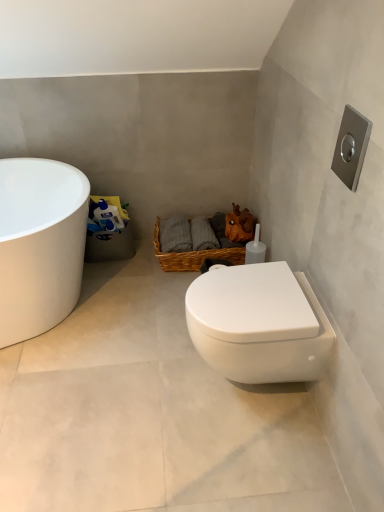
Question: Does white glossy toilet at lower right have a smaller size compared to white glossy bathtub at left?

Choices:
 (A) yes
 (B) no

Answer: (A)

Question: Does white glossy toilet at lower right have a larger size compared to white glossy bathtub at left?

Choices:
 (A) yes
 (B) no

Answer: (B)

Question: Does white glossy toilet at lower right have a greater width compared to white glossy bathtub at left?

Choices:
 (A) no
 (B) yes

Answer: (B)

Question: From a real-world perspective, is white glossy toilet at lower right physically below white glossy bathtub at left?

Choices:
 (A) yes
 (B) no

Answer: (A)

Question: From the image's perspective, is white glossy toilet at lower right on top of white glossy bathtub at left?

Choices:
 (A) yes
 (B) no

Answer: (B)

Question: From a real-world perspective, is white glossy bathtub at left physically located above or below white glossy toilet at lower right?

Choices:
 (A) below
 (B) above

Answer: (B)

Question: Is white glossy bathtub at left taller or shorter than white glossy toilet at lower right?

Choices:
 (A) tall
 (B) short

Answer: (A)

Question: Is white glossy bathtub at left inside or outside of white glossy toilet at lower right?

Choices:
 (A) outside
 (B) inside

Answer: (A)

Question: From the image's perspective, is white glossy bathtub at left positioned above or below white glossy toilet at lower right?

Choices:
 (A) above
 (B) below

Answer: (A)

Question: Considering the positions of white glossy bathtub at left and white glossy toilet at lower right in the image, is white glossy bathtub at left bigger or smaller than white glossy toilet at lower right?

Choices:
 (A) big
 (B) small

Answer: (A)

Question: Is point (54, 262) positioned closer to the camera than point (266, 354)?

Choices:
 (A) closer
 (B) farther

Answer: (B)

Question: Visually, is white glossy bathtub at left positioned to the left or to the right of white glossy toilet at lower right?

Choices:
 (A) left
 (B) right

Answer: (A)

Question: From the image's perspective, is white glossy bathtub at left positioned above or below white glossy toilet at lower right?

Choices:
 (A) below
 (B) above

Answer: (B)

Question: From a real-world perspective, is woven brown basket at center physically located above or below white glossy toilet at lower right?

Choices:
 (A) below
 (B) above

Answer: (B)

Question: Is woven brown basket at center situated inside white glossy toilet at lower right or outside?

Choices:
 (A) outside
 (B) inside

Answer: (A)